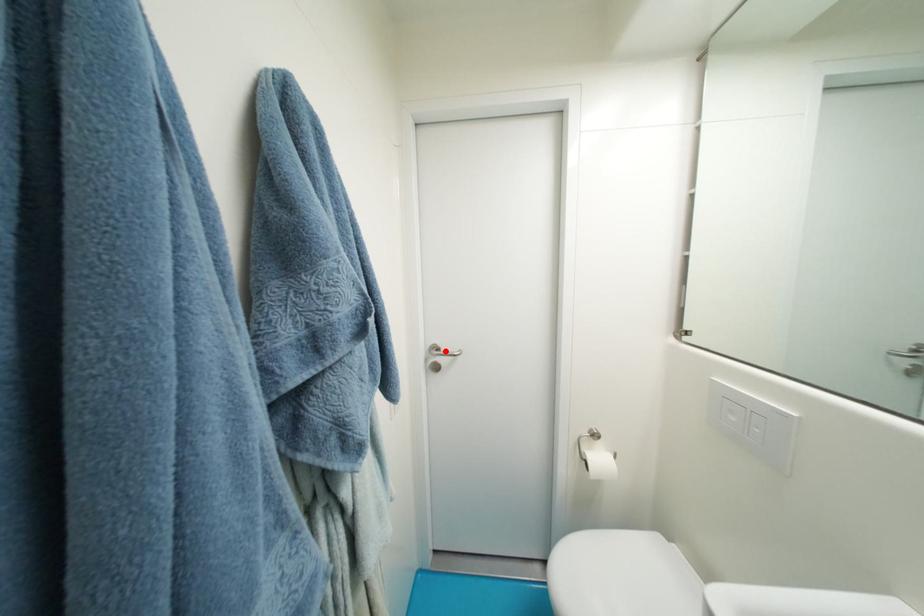
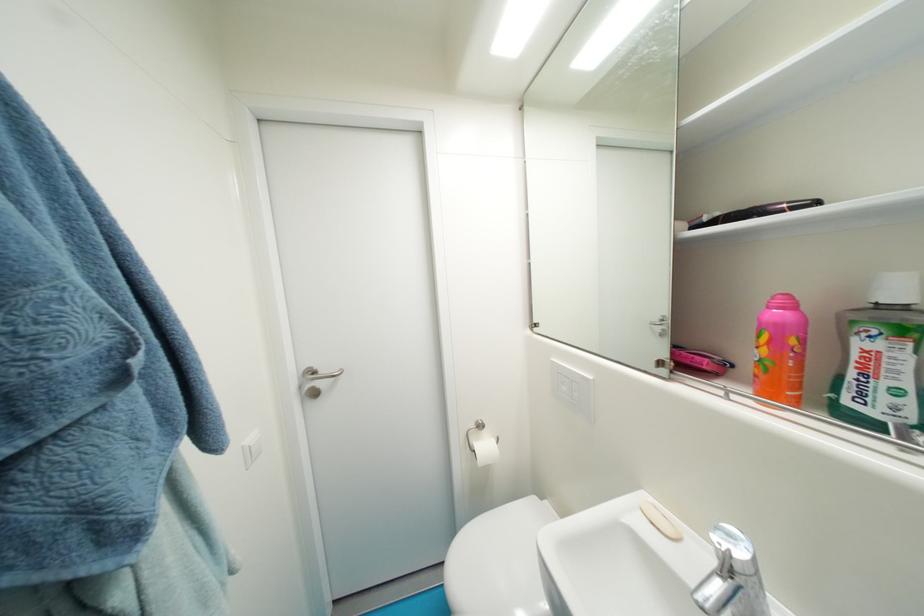
Find the pixel in the second image that matches the highlighted location in the first image.

(322, 374)